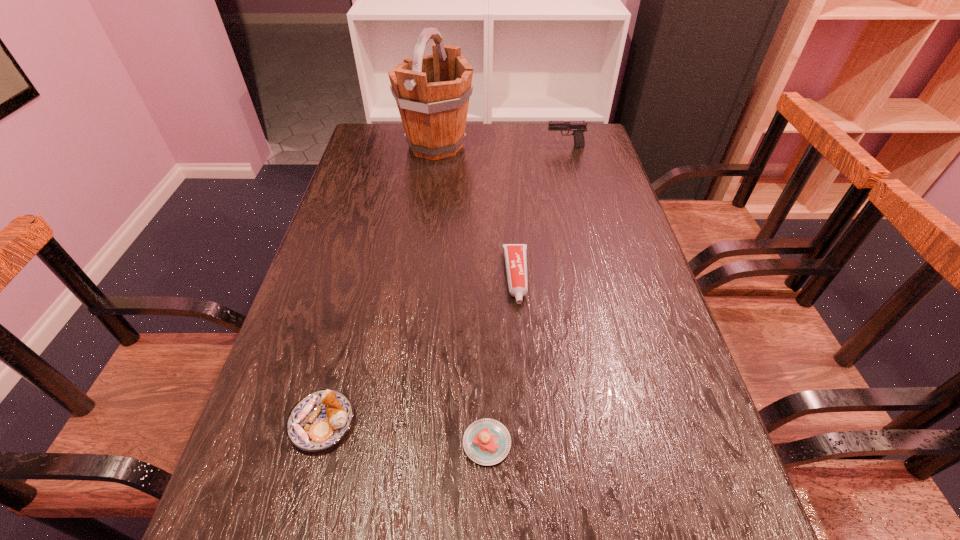
In order to click on vacant space located 0.070m aim along the barrel of the pistol in this screenshot , I will do `click(525, 147)`.

Find the location of a particular element. The image size is (960, 540). free space located aim along the barrel of the pistol is located at coordinates (477, 147).

Find the location of a particular element. The image size is (960, 540). vacant region located 0.370m on the right of the taller pastry is located at coordinates (559, 422).

Where is `free space located at the nozzle of the third farthest object`? This screenshot has width=960, height=540. free space located at the nozzle of the third farthest object is located at coordinates (521, 336).

Identify the location of free space located on the back of the shortest object. (486, 355).

The width and height of the screenshot is (960, 540). I want to click on bucket at the far edge, so click(x=432, y=92).

Identify the location of pistol located in the far edge section of the desktop. This screenshot has width=960, height=540. (578, 127).

The image size is (960, 540). I want to click on bucket at the left edge, so click(432, 92).

At what (x,y) coordinates should I click in order to perform the action: click on pastry at the left edge. Please return your answer as a coordinate pair (x, y). Looking at the image, I should click on (318, 421).

You are a GUI agent. You are given a task and a screenshot of the screen. Output one action in this format:
    pyautogui.click(x=<x>, y=<y>)
    Task: Click on the object that is at the right edge
    
    Given the screenshot: What is the action you would take?
    pyautogui.click(x=578, y=127)